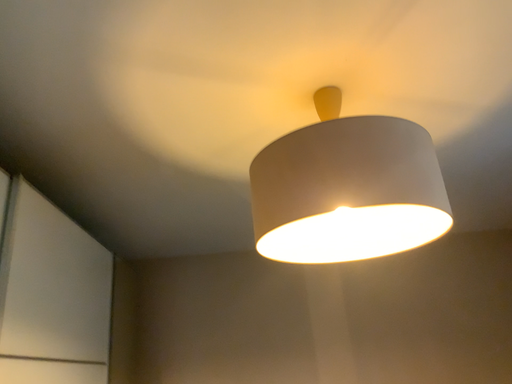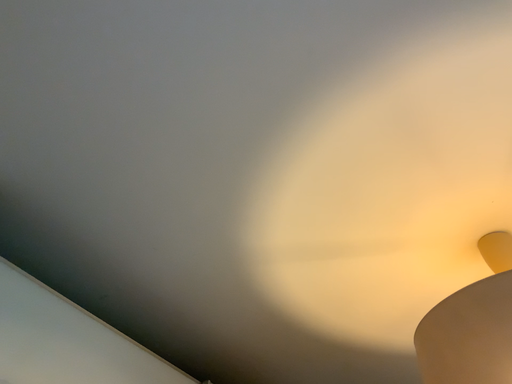
Question: Which way did the camera rotate in the video?

Choices:
 (A) rotated downward
 (B) rotated upward

Answer: (B)